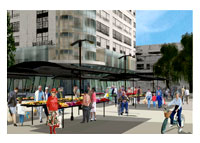
The width and height of the screenshot is (200, 143). Identify the location of windows. coord(44,21), coord(105,27), coord(103,15), coord(118,23), coord(128,19), coord(126,39), coord(118,39), coord(139,65).